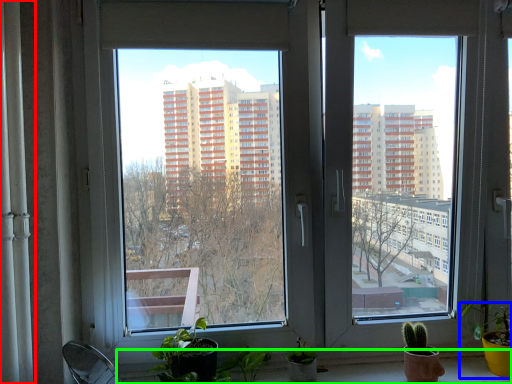
Question: Estimate the real-world distances between objects in this image. Which object is farther from curtain (highlighted by a red box), houseplant (highlighted by a blue box) or window sill (highlighted by a green box)?

Choices:
 (A) houseplant
 (B) window sill

Answer: (A)